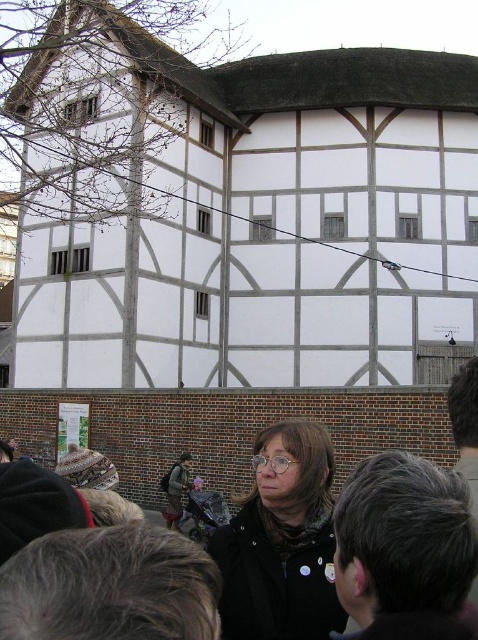
Who is higher up, dark gray hair at upper right or matte black coat at center?

dark gray hair at upper right is higher up.

The image size is (478, 640). What do you see at coordinates (404, 548) in the screenshot?
I see `dark gray hair at upper right` at bounding box center [404, 548].

The width and height of the screenshot is (478, 640). Identify the location of dark gray hair at upper right. (404, 548).